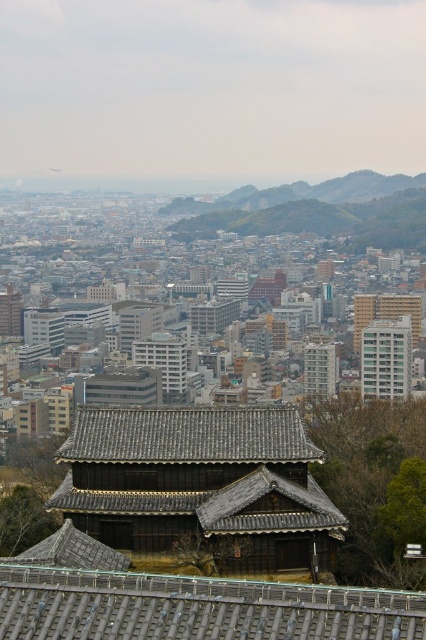
Is matte brown wooden temple at center to the right of wooden shingles temple at center from the viewer's perspective?

Incorrect, matte brown wooden temple at center is not on the right side of wooden shingles temple at center.

Is point (178, 529) positioned in front of point (389, 314)?

Yes, point (178, 529) is in front of point (389, 314).

Where is `matte brown wooden temple at center`? matte brown wooden temple at center is located at coordinates (199, 488).

Which is more to the left, matte brown wooden temple at center or white glossy building at upper right?

matte brown wooden temple at center

Which of these two, matte brown wooden temple at center or white glossy building at upper right, stands shorter?

With less height is matte brown wooden temple at center.

Is point (100, 428) positioned before point (394, 372)?

That is True.

Identify the location of matte brown wooden temple at center. The image size is (426, 640). click(x=199, y=488).

Between white glossy building at upper right and wooden shingles temple at center, which one is positioned lower?

Positioned lower is white glossy building at upper right.

Between point (385, 362) and point (356, 324), which one is positioned in front?

Positioned in front is point (385, 362).

Image resolution: width=426 pixels, height=640 pixels. I want to click on white glossy building at upper right, so click(x=385, y=358).